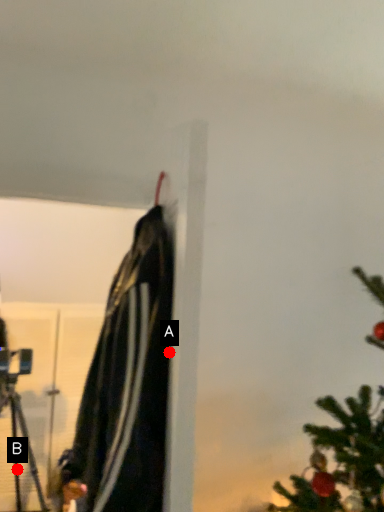
Question: Two points are circled on the image, labeled by A and B beside each circle. Which point appears farthest from the camera in this image?

Choices:
 (A) A is further
 (B) B is further

Answer: (B)